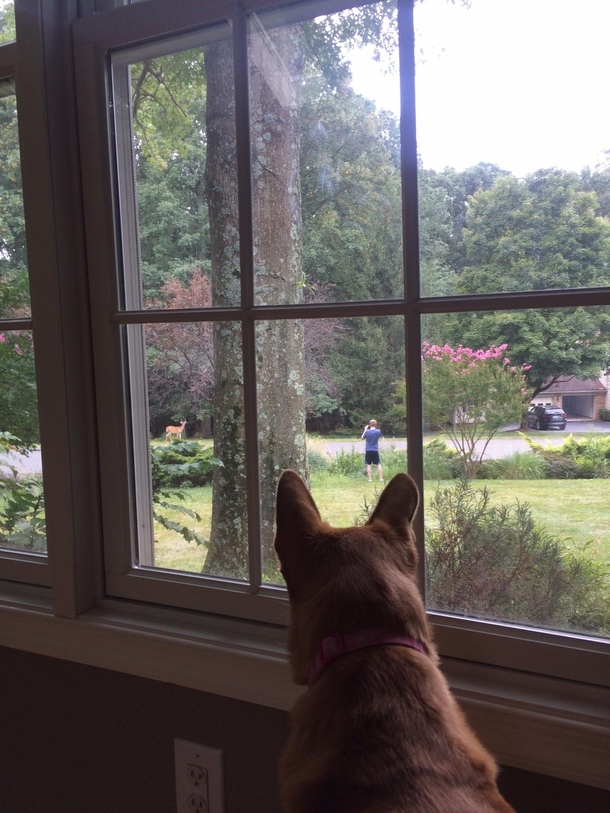
I want to click on light socket, so click(x=199, y=783).